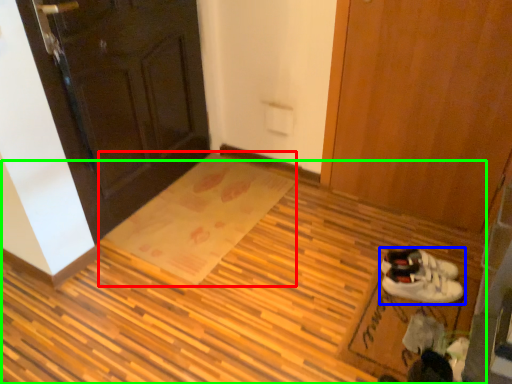
Question: Estimate the real-world distances between objects in this image. Which object is farther from doormat (highlighted by a red box), footwear (highlighted by a blue box) or plywood (highlighted by a green box)?

Choices:
 (A) footwear
 (B) plywood

Answer: (A)